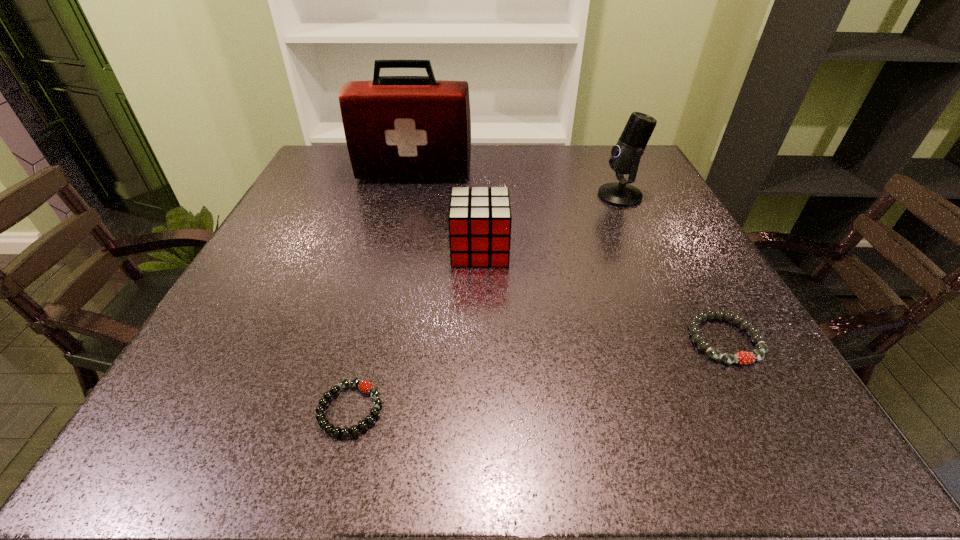
Identify the location of bracelet present at the right edge. The image size is (960, 540). (742, 357).

Locate an element on the screen. The height and width of the screenshot is (540, 960). object located in the far left corner section of the desktop is located at coordinates (396, 127).

Image resolution: width=960 pixels, height=540 pixels. Find the location of `object positioned at the far right corner`. object positioned at the far right corner is located at coordinates (625, 157).

The image size is (960, 540). I want to click on free space at the far edge of the desktop, so click(558, 172).

Locate an element on the screen. Image resolution: width=960 pixels, height=540 pixels. vacant space at the near edge of the desktop is located at coordinates (348, 403).

Image resolution: width=960 pixels, height=540 pixels. I want to click on free space at the left edge, so click(x=339, y=207).

In the image, there is a desktop. At what (x,y) coordinates should I click in order to perform the action: click on vacant space at the right edge. Please return your answer as a coordinate pair (x, y). The image size is (960, 540). Looking at the image, I should click on (687, 259).

At what (x,y) coordinates should I click in order to perform the action: click on vacant area at the far right corner of the desktop. Please return your answer as a coordinate pair (x, y). Looking at the image, I should click on (586, 150).

Where is `vacant point at the near right corner`? The height and width of the screenshot is (540, 960). vacant point at the near right corner is located at coordinates (694, 415).

Image resolution: width=960 pixels, height=540 pixels. I want to click on free space between the cube and the fourth farthest object, so click(602, 295).